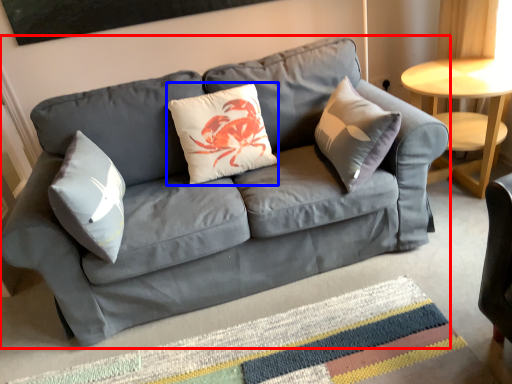
Question: Among these objects, which one is nearest to the camera, studio couch (highlighted by a red box) or pillow (highlighted by a blue box)?

Choices:
 (A) studio couch
 (B) pillow

Answer: (A)